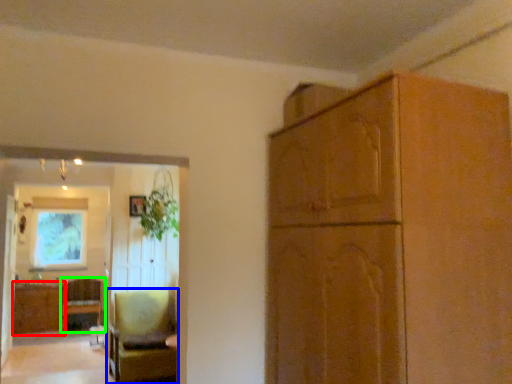
Question: Which is farther away from cabinetry (highlighted by a red box)? chair (highlighted by a blue box) or chair (highlighted by a green box)?

Choices:
 (A) chair
 (B) chair

Answer: (A)